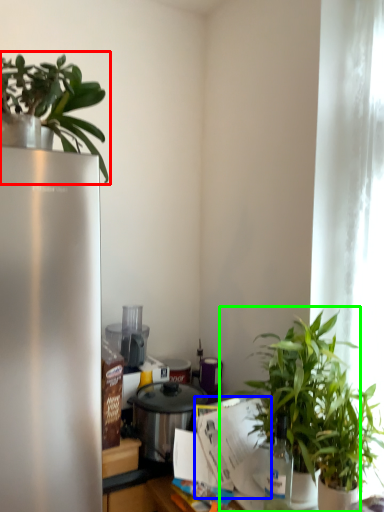
Question: Which object is the farthest from houseplant (highlighted by a red box)? Choose among these: paper (highlighted by a blue box) or houseplant (highlighted by a green box).

Choices:
 (A) paper
 (B) houseplant

Answer: (A)